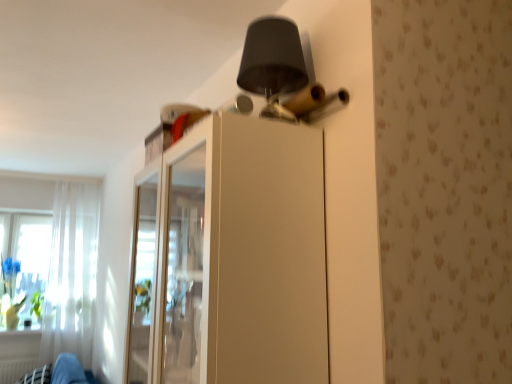
Identify the location of black fabric swivel chair at lower left. (60, 373).

Where is `white sheer curtain at left`? The height and width of the screenshot is (384, 512). white sheer curtain at left is located at coordinates (71, 273).

Find the location of a particular element. Image resolution: width=512 pixels, height=384 pixels. dresser on the right side of black fabric swivel chair at lower left is located at coordinates (230, 257).

Based on the photo, which object is further away from the camera, black fabric swivel chair at lower left or white glossy cabinet at upper center?

Positioned behind is black fabric swivel chair at lower left.

Is black fabric swivel chair at lower left to the right of white glossy cabinet at upper center from the viewer's perspective?

In fact, black fabric swivel chair at lower left is to the left of white glossy cabinet at upper center.

Based on their sizes in the image, would you say black fabric swivel chair at lower left is bigger or smaller than white glossy cabinet at upper center?

Clearly, black fabric swivel chair at lower left is smaller in size than white glossy cabinet at upper center.

Is white glossy cabinet at upper center surrounding white sheer curtain at left?

That's incorrect, white sheer curtain at left is not inside white glossy cabinet at upper center.

From the image's perspective, is white glossy cabinet at upper center located above or below white sheer curtain at left?

From the image's perspective, white glossy cabinet at upper center appears above white sheer curtain at left.

Which object is thinner, white glossy cabinet at upper center or white sheer curtain at left?

With smaller width is white sheer curtain at left.

How many degrees apart are the facing directions of white glossy cabinet at upper center and white sheer curtain at left?

86.4 degrees.

From a real-world perspective, does white sheer curtain at left stand above black fabric swivel chair at lower left?

Yes, from a real-world perspective, white sheer curtain at left is on top of black fabric swivel chair at lower left.

From the image's perspective, does white sheer curtain at left appear higher than black fabric swivel chair at lower left?

Yes, from the image's perspective, white sheer curtain at left is over black fabric swivel chair at lower left.

In the image, is white sheer curtain at left positioned in front of or behind black fabric swivel chair at lower left?

In the image, white sheer curtain at left appears behind black fabric swivel chair at lower left.

Between point (84, 213) and point (26, 375), which one is positioned behind?

Positioned behind is point (84, 213).

How different are the orientations of black fabric swivel chair at lower left and white sheer curtain at left in degrees?

62.6 degrees separate the facing orientations of black fabric swivel chair at lower left and white sheer curtain at left.

Looking at the image, does black fabric swivel chair at lower left seem bigger or smaller compared to white sheer curtain at left?

Clearly, black fabric swivel chair at lower left is smaller in size than white sheer curtain at left.

Is black fabric swivel chair at lower left surrounding white sheer curtain at left?

No, white sheer curtain at left is not inside black fabric swivel chair at lower left.

Which point is more distant from viewer, (49, 365) or (65, 336)?

The point (65, 336) is farther.

Which is more to the left, white glossy cabinet at upper center or black fabric swivel chair at lower left?

Positioned to the left is black fabric swivel chair at lower left.

How distant is white glossy cabinet at upper center from black fabric swivel chair at lower left?

white glossy cabinet at upper center is 7.23 feet from black fabric swivel chair at lower left.

In the scene shown: From the image's perspective, is white glossy cabinet at upper center on top of black fabric swivel chair at lower left?

Indeed, from the image's perspective, white glossy cabinet at upper center is shown above black fabric swivel chair at lower left.

Consider the image. Is white glossy cabinet at upper center thinner than black fabric swivel chair at lower left?

Correct, the width of white glossy cabinet at upper center is less than that of black fabric swivel chair at lower left.

Is white glossy cabinet at upper center at the back of white sheer curtain at left?

No.

Is white sheer curtain at left to the left or to the right of white glossy cabinet at upper center in the image?

white sheer curtain at left is positioned on white glossy cabinet at upper center's left side.

Considering the positions of points (52, 347) and (240, 135), is point (52, 347) closer to camera compared to point (240, 135)?

No, it is not.

Is white sheer curtain at left taller or shorter than white glossy cabinet at upper center?

white sheer curtain at left is taller than white glossy cabinet at upper center.

Find the location of a particular element. swivel chair to the left of white glossy cabinet at upper center is located at coordinates (60, 373).

Find the location of a particular element. The image size is (512, 384). curtain that appears below the white glossy cabinet at upper center (from a real-world perspective) is located at coordinates coord(71,273).

Considering their positions, is white sheer curtain at left positioned further to white glossy cabinet at upper center than black fabric swivel chair at lower left?

white sheer curtain at left is further to white glossy cabinet at upper center.

Based on their spatial positions, is white sheer curtain at left or white glossy cabinet at upper center further from black fabric swivel chair at lower left?

Based on the image, white glossy cabinet at upper center appears to be further to black fabric swivel chair at lower left.

Which object lies further to the anchor point white glossy cabinet at upper center, black fabric swivel chair at lower left or white sheer curtain at left?

white sheer curtain at left.

Considering their positions, is white glossy cabinet at upper center positioned closer to white sheer curtain at left than black fabric swivel chair at lower left?

Based on the image, black fabric swivel chair at lower left appears to be nearer to white sheer curtain at left.

Which object lies further to the anchor point white sheer curtain at left, black fabric swivel chair at lower left or white glossy cabinet at upper center?

white glossy cabinet at upper center.

Based on their spatial positions, is white glossy cabinet at upper center or white sheer curtain at left closer to black fabric swivel chair at lower left?

Based on the image, white sheer curtain at left appears to be nearer to black fabric swivel chair at lower left.

I want to click on swivel chair located between white glossy cabinet at upper center and white sheer curtain at left in the depth direction, so point(60,373).